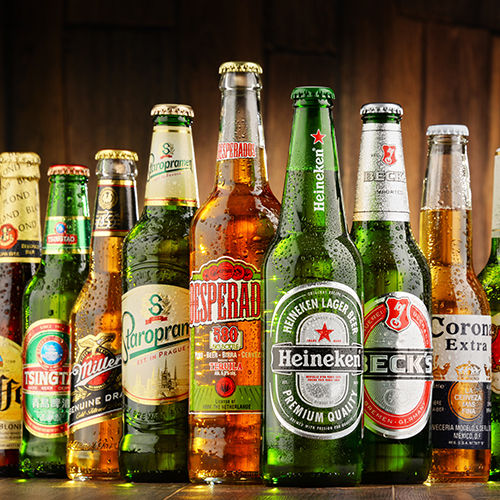
Where is `bottle`? The height and width of the screenshot is (500, 500). bottle is located at coordinates (23, 284), (62, 281), (109, 279), (160, 260), (250, 234), (325, 256), (388, 253), (457, 247), (487, 276).